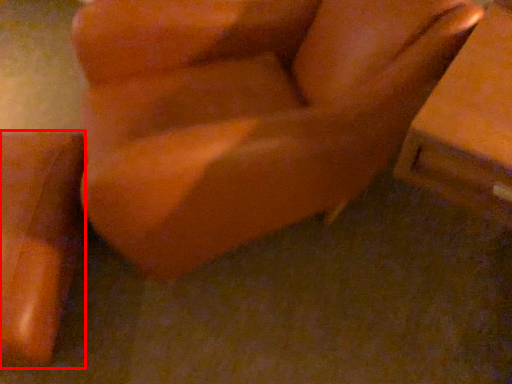
Question: Observing the image, what is the correct spatial positioning of furniture (annotated by the red box) in reference to furniture?

Choices:
 (A) right
 (B) left

Answer: (B)